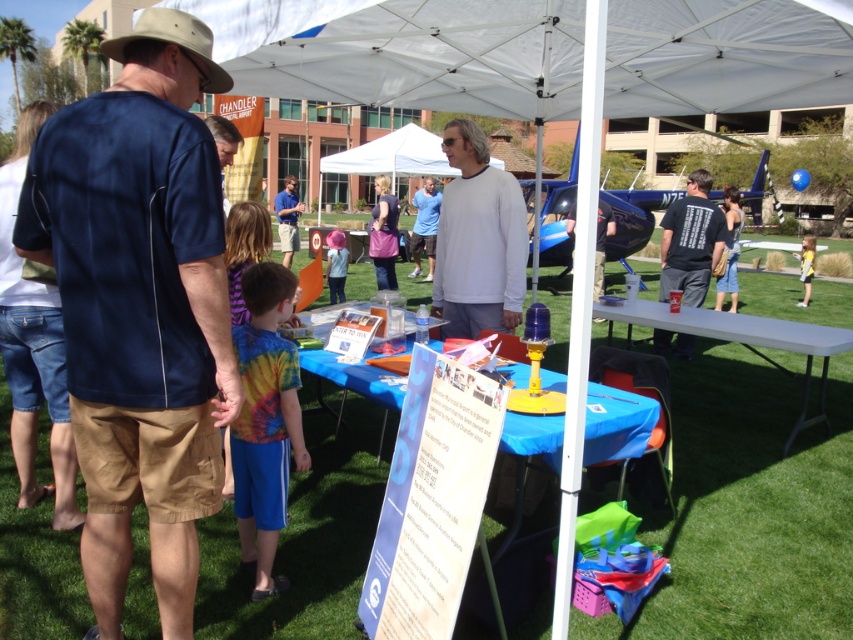
Between white plastic table at right and blue shirt at center, which one appears on the left side from the viewer's perspective?

From the viewer's perspective, blue shirt at center appears more on the left side.

Which is in front, point (825, 332) or point (294, 224)?

Point (825, 332) is in front.

Is point (814, 348) more distant than point (293, 202)?

No, it is in front of (293, 202).

What are the coordinates of `white plastic table at right` in the screenshot? It's located at (741, 339).

The height and width of the screenshot is (640, 853). What do you see at coordinates (479, 241) in the screenshot? I see `white matte long-sleeve shirt at center` at bounding box center [479, 241].

Is white matte long-sleeve shirt at center to the right of pink fabric umbrella at center from the viewer's perspective?

Indeed, white matte long-sleeve shirt at center is positioned on the right side of pink fabric umbrella at center.

Who is more distant from viewer, (515, 257) or (328, 280)?

The point (328, 280) is more distant.

The width and height of the screenshot is (853, 640). I want to click on white matte long-sleeve shirt at center, so click(x=479, y=241).

Between blue cotton shirt at center and yellow fabric shirt at right, which one appears on the left side from the viewer's perspective?

Positioned to the left is blue cotton shirt at center.

Is blue cotton shirt at center wider than yellow fabric shirt at right?

Incorrect, blue cotton shirt at center's width does not surpass yellow fabric shirt at right's.

Who is more distant from viewer, (410, 246) or (805, 234)?

The point (805, 234) is more distant.

Where is `blue cotton shirt at center`? The height and width of the screenshot is (640, 853). blue cotton shirt at center is located at coordinates (424, 227).